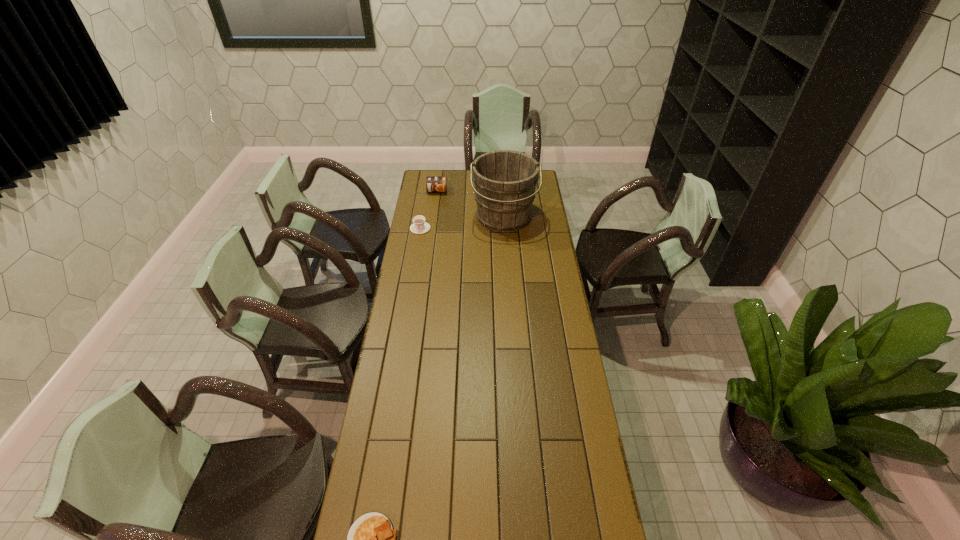
The width and height of the screenshot is (960, 540). I want to click on the rightmost object, so click(x=505, y=180).

The height and width of the screenshot is (540, 960). In order to click on the tallest object in this screenshot , I will do `click(505, 180)`.

Locate an element on the screen. Image resolution: width=960 pixels, height=540 pixels. the second tallest object is located at coordinates (433, 183).

At what (x,y) coordinates should I click in order to perform the action: click on the farthest object. Please return your answer as a coordinate pair (x, y). Looking at the image, I should click on (433, 183).

Where is `teacup`? This screenshot has height=540, width=960. teacup is located at coordinates (419, 226).

The height and width of the screenshot is (540, 960). I want to click on free location located 0.390m on the handle side of the rightmost object, so click(509, 291).

Where is `vacant position located on the front label of the third shortest object`? The width and height of the screenshot is (960, 540). vacant position located on the front label of the third shortest object is located at coordinates (431, 236).

The height and width of the screenshot is (540, 960). Identify the location of free space located 0.210m on the handle side of the teacup. (415, 260).

Find the location of a particular element. The image size is (960, 540). object at the far edge is located at coordinates (433, 183).

Where is `can located in the left edge section of the desktop`? can located in the left edge section of the desktop is located at coordinates (433, 183).